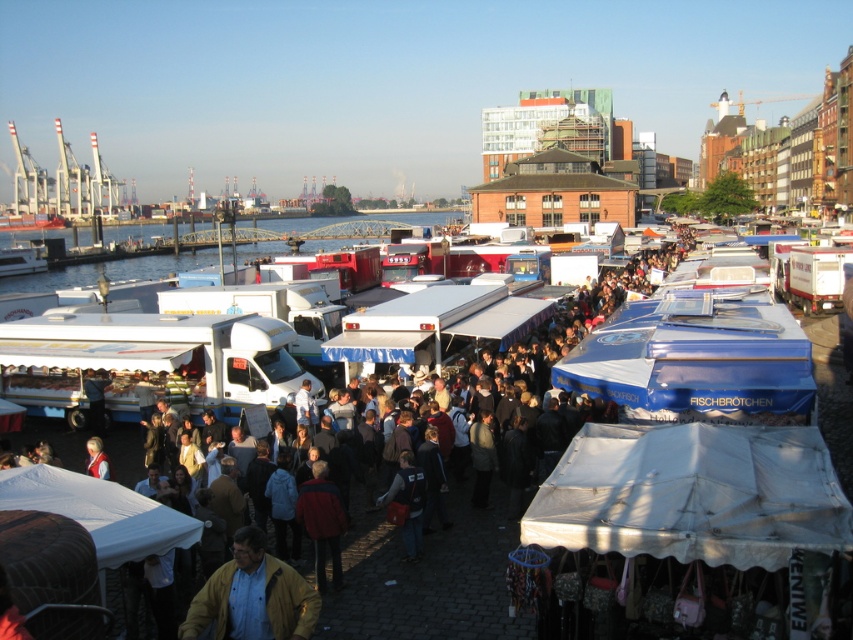
Question: Which of the following is the farthest from the observer?

Choices:
 (A) matte black backpack at center
 (B) matte yellow jacket at lower left

Answer: (A)

Question: Observing the image, what is the correct spatial positioning of white fabric canopy at lower right in reference to matte black backpack at center?

Choices:
 (A) right
 (B) left

Answer: (A)

Question: Estimate the real-world distances between objects in this image. Which object is farther from the white fabric canopy at lower right?

Choices:
 (A) red wool sweater at lower left
 (B) red jacket at center

Answer: (A)

Question: In this image, where is white fabric canopy at lower right located relative to matte yellow jacket at lower left?

Choices:
 (A) below
 (B) above

Answer: (B)

Question: Does matte black backpack at center have a lesser width compared to red wool sweater at lower left?

Choices:
 (A) yes
 (B) no

Answer: (B)

Question: Which point is closer to the camera taking this photo?

Choices:
 (A) (321, 500)
 (B) (90, 449)
 (C) (421, 520)

Answer: (A)